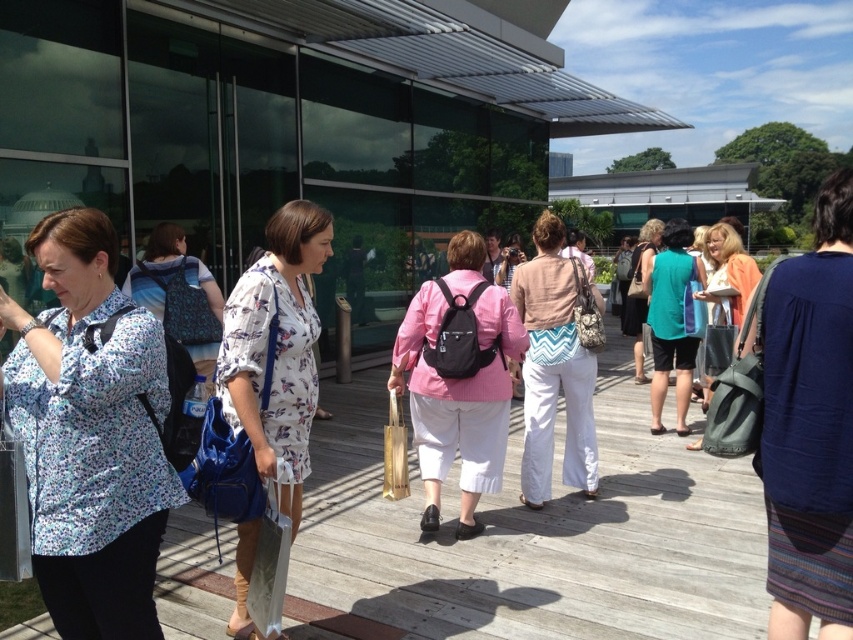
Question: Which of the following is the farthest from the observer?

Choices:
 (A) matte gray tote bag at center right
 (B) white floral dress at center
 (C) pink matte backpack at center

Answer: (A)

Question: Can you confirm if pink matte backpack at center is positioned to the left of white floral dress at center?

Choices:
 (A) yes
 (B) no

Answer: (B)

Question: Which point is farther from the camera taking this photo?

Choices:
 (A) (447, 388)
 (B) (527, 416)
 (C) (642, 312)

Answer: (C)

Question: Considering the relative positions of printed fabric blouse at left and matte gray tote bag at center right in the image provided, where is printed fabric blouse at left located with respect to matte gray tote bag at center right?

Choices:
 (A) left
 (B) right

Answer: (A)

Question: Is pink matte backpack at center positioned before white floral dress at center?

Choices:
 (A) no
 (B) yes

Answer: (A)

Question: Which object is positioned farthest from the printed fabric blouse at left?

Choices:
 (A) matte gray tote bag at center right
 (B) chevron-patterned bag at center

Answer: (A)